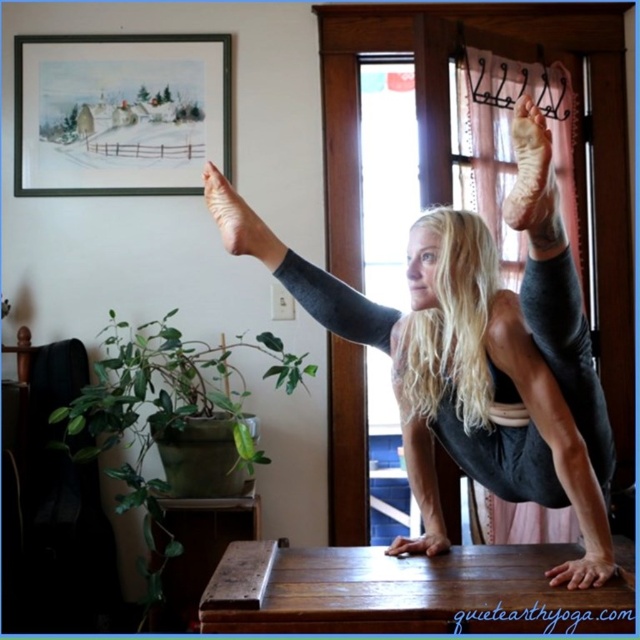
You are a fitness instructor observing a student attempting a handstand. The student is positioned in front of a wooden table. You notice a point at coordinates (x=476, y=353) on the image. What object does this point correspond to?

The point at coordinates 0.554, 0.744 corresponds to the matte gray leggings at center.

You are standing in the room and want to place a 1.5 feet wide yoga mat between you and the matte gray leggings at center. Is there enough space?

The distance between you and the matte gray leggings at center is 3.42 feet, which is greater than the yoga mat width of 1.5 feet. Yes, there is enough space to place the yoga mat between you and the matte gray leggings at center.